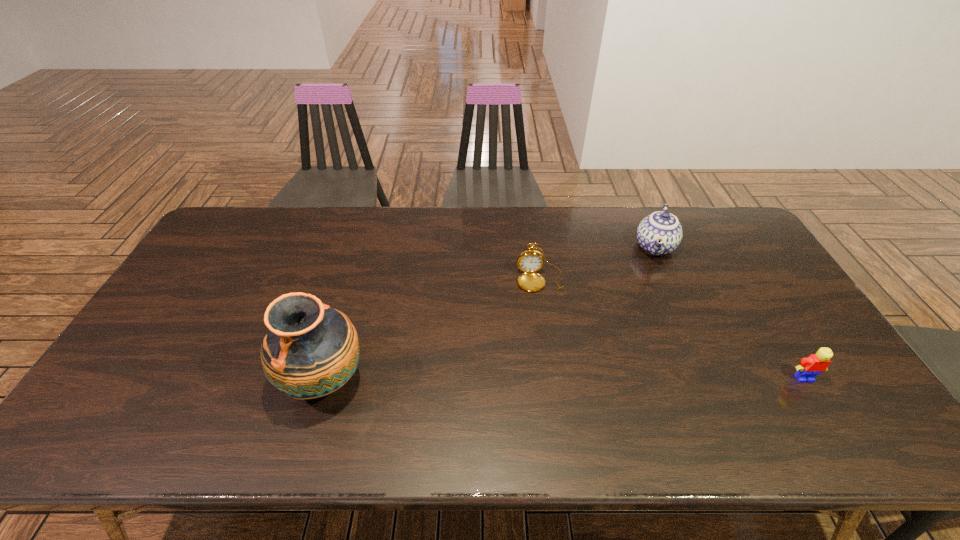
At what (x,y) coordinates should I click in order to perform the action: click on the leftmost object. Please return your answer as a coordinate pair (x, y). Looking at the image, I should click on (310, 350).

Locate an element on the screen. Image resolution: width=960 pixels, height=540 pixels. pottery is located at coordinates (310, 350).

Where is `Lego`? The height and width of the screenshot is (540, 960). Lego is located at coordinates (809, 368).

Find the location of a particular element. The image size is (960, 540). the third object from right to left is located at coordinates (530, 261).

In order to click on chinaware in this screenshot , I will do `click(660, 233)`.

This screenshot has width=960, height=540. I want to click on free space located 0.130m on the back of the tallest object, so click(346, 309).

Identify the location of vacant region located on the front-facing side of the rightmost object. (820, 404).

The width and height of the screenshot is (960, 540). I want to click on blank area located 0.290m on the face of the pocket watch, so click(557, 375).

Find the location of a particular element. blank area located on the face of the pocket watch is located at coordinates tap(555, 365).

Locate an element on the screen. The height and width of the screenshot is (540, 960). free space located 0.130m on the face of the pocket watch is located at coordinates (548, 326).